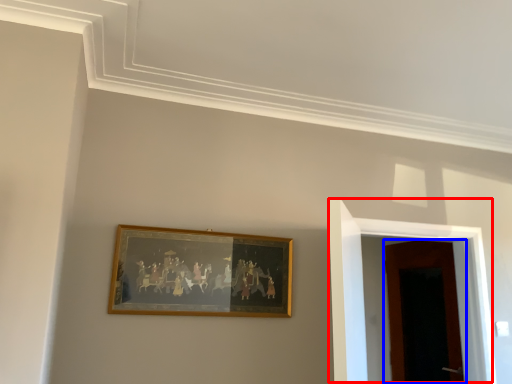
Question: Which object appears farthest to the camera in this image, door (highlighted by a red box) or door (highlighted by a blue box)?

Choices:
 (A) door
 (B) door

Answer: (B)